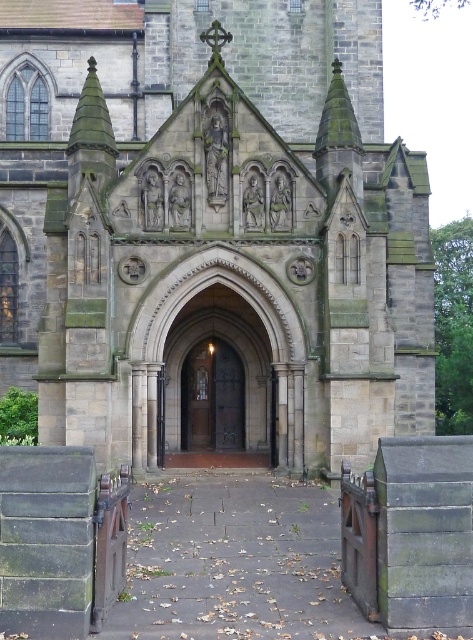
Is dark gray stone church at center above brown wooden door at center?

Indeed, dark gray stone church at center is positioned over brown wooden door at center.

Is point (241, 161) positioned before point (233, 390)?

Yes, point (241, 161) is in front of point (233, 390).

I want to click on dark gray stone church at center, so click(x=210, y=225).